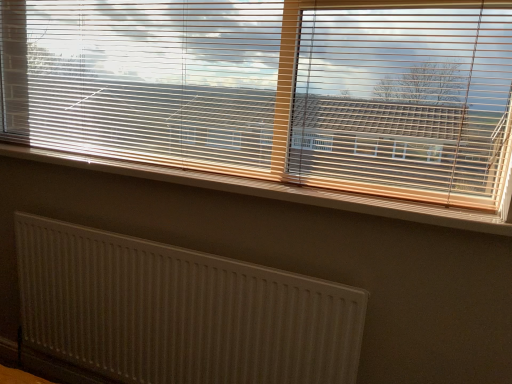
Question: Is white plastic radiator at lower center at the back of white textured radiator at lower left?

Choices:
 (A) yes
 (B) no

Answer: (B)

Question: Can we say white textured radiator at lower left lies outside white plastic radiator at lower center?

Choices:
 (A) yes
 (B) no

Answer: (A)

Question: Does white textured radiator at lower left have a greater height compared to white plastic radiator at lower center?

Choices:
 (A) no
 (B) yes

Answer: (B)

Question: Is white textured radiator at lower left closer to camera compared to white plastic radiator at lower center?

Choices:
 (A) yes
 (B) no

Answer: (B)

Question: Is white textured radiator at lower left smaller than white plastic radiator at lower center?

Choices:
 (A) yes
 (B) no

Answer: (B)

Question: In terms of height, does white textured radiator at lower left look taller or shorter compared to wooden blinds at upper center?

Choices:
 (A) tall
 (B) short

Answer: (B)

Question: Is point (151, 372) positioned closer to the camera than point (163, 139)?

Choices:
 (A) farther
 (B) closer

Answer: (A)

Question: From the image's perspective, is white textured radiator at lower left above or below wooden blinds at upper center?

Choices:
 (A) below
 (B) above

Answer: (A)

Question: Is white textured radiator at lower left wider or thinner than wooden blinds at upper center?

Choices:
 (A) wide
 (B) thin

Answer: (B)

Question: From a real-world perspective, relative to white plastic radiator at lower center, is wooden blinds at upper center vertically above or below?

Choices:
 (A) above
 (B) below

Answer: (A)

Question: From the image's perspective, relative to white plastic radiator at lower center, is wooden blinds at upper center above or below?

Choices:
 (A) above
 (B) below

Answer: (A)

Question: Choose the correct answer: Is wooden blinds at upper center inside white plastic radiator at lower center or outside it?

Choices:
 (A) outside
 (B) inside

Answer: (A)

Question: Considering the positions of wooden blinds at upper center and white plastic radiator at lower center in the image, is wooden blinds at upper center bigger or smaller than white plastic radiator at lower center?

Choices:
 (A) small
 (B) big

Answer: (B)

Question: Does point (175, 326) appear closer or farther from the camera than point (357, 198)?

Choices:
 (A) closer
 (B) farther

Answer: (B)

Question: In terms of height, does white textured radiator at lower left look taller or shorter compared to white plastic radiator at lower center?

Choices:
 (A) tall
 (B) short

Answer: (A)